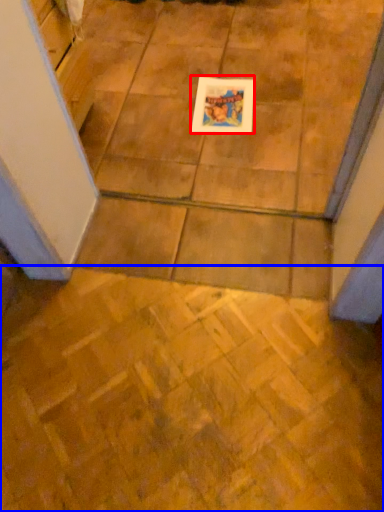
Question: Which object appears farthest to the camera in this image, picture frame (highlighted by a red box) or ceramic tile (highlighted by a blue box)?

Choices:
 (A) picture frame
 (B) ceramic tile

Answer: (A)